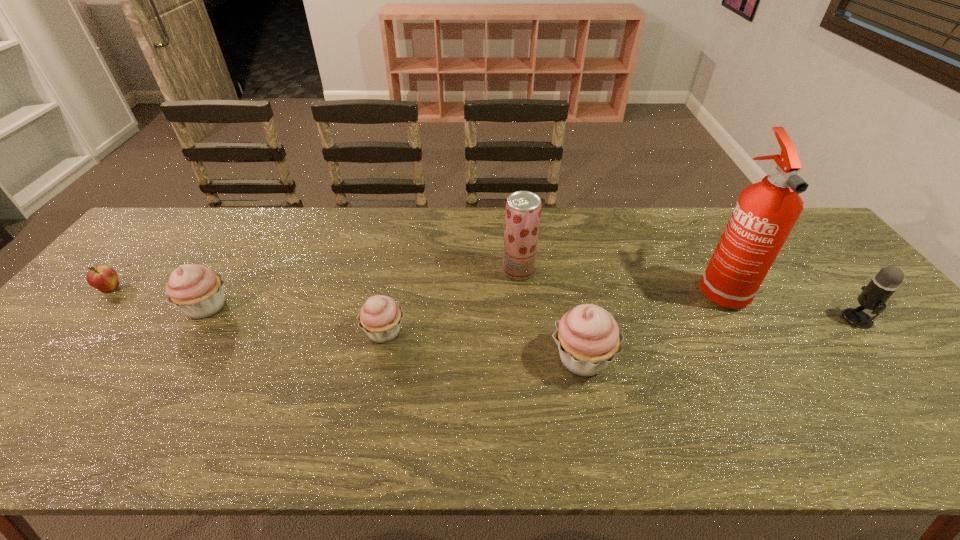
Where is `the leftmost object`? The width and height of the screenshot is (960, 540). the leftmost object is located at coordinates (104, 278).

The image size is (960, 540). What are the coordinates of `the shortest object` in the screenshot? It's located at (104, 278).

Locate an element on the screen. vacant space situated on the front of the leftmost cupcake is located at coordinates (159, 383).

Find the location of a particular element. Image resolution: width=960 pixels, height=540 pixels. vacant space located 0.380m on the left of the second cupcake from right to left is located at coordinates (212, 332).

Where is `blank space located on the left of the rightmost cupcake`? This screenshot has height=540, width=960. blank space located on the left of the rightmost cupcake is located at coordinates (403, 359).

Find the location of a particular element. blank area located 0.170m on the front of the fourth object from right to left is located at coordinates (524, 328).

Where is `vacant region located 0.360m on the back of the microphone`? This screenshot has width=960, height=540. vacant region located 0.360m on the back of the microphone is located at coordinates (781, 228).

Find the location of a particular element. This screenshot has height=540, width=960. vacant area situated at the nozzle of the sixth object from left to right is located at coordinates (782, 400).

You are a GUI agent. You are given a task and a screenshot of the screen. Output one action in this format:
    pyautogui.click(x=<x>, y=<y>)
    Task: Click on the vacant region located 0.230m on the right of the apple
    This screenshot has height=540, width=960.
    Given the screenshot: What is the action you would take?
    pyautogui.click(x=205, y=289)

You are a GUI agent. You are given a task and a screenshot of the screen. Output one action in this format:
    pyautogui.click(x=<x>, y=<y>)
    Task: Click on the object situated at the near edge
    
    Given the screenshot: What is the action you would take?
    point(588,338)